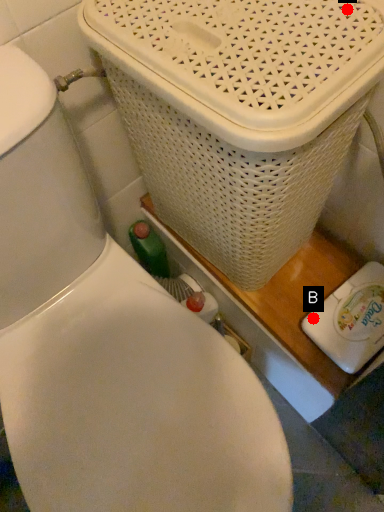
Question: Two points are circled on the image, labeled by A and B beside each circle. Which point is farther to the camera?

Choices:
 (A) A is further
 (B) B is further

Answer: (B)